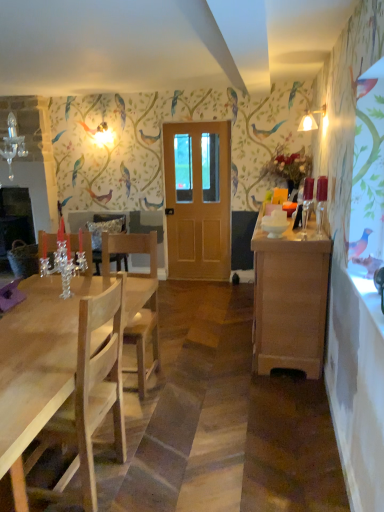
Locate an element on the screen. light brown wooden door at center is located at coordinates (198, 199).

Image resolution: width=384 pixels, height=512 pixels. Describe the element at coordinates (290, 300) in the screenshot. I see `wooden cabinet at right` at that location.

Where is `wooden cabinet at right`? The height and width of the screenshot is (512, 384). wooden cabinet at right is located at coordinates (290, 300).

The height and width of the screenshot is (512, 384). Identify the location of light wood chair at left, the first chair when ordered from front to back. (91, 384).

From the image's perspective, who appears lower, wooden cabinet at right or natural wood chair at left, acting as the 1th chair starting from the back?

natural wood chair at left, acting as the 1th chair starting from the back, is shown below in the image.

Measure the distance between wooden cabinet at right and natural wood chair at left, acting as the 1th chair starting from the back.

They are 95.47 centimeters apart.

Which is more to the right, wooden cabinet at right or natural wood chair at left, acting as the 1th chair starting from the back?

wooden cabinet at right.

Is the depth of matte white lampshade at upper right greater than that of natural wood chair at left, acting as the 1th chair starting from the back?

Yes, matte white lampshade at upper right is further from the viewer.

From the image's perspective, is matte white lampshade at upper right above or below natural wood chair at left, placed as the 2th chair when sorted from front to back?

Clearly, from the image's perspective, matte white lampshade at upper right is above natural wood chair at left, placed as the 2th chair when sorted from front to back.

How far apart are matte white lampshade at upper right and natural wood chair at left, acting as the 1th chair starting from the back?

matte white lampshade at upper right and natural wood chair at left, acting as the 1th chair starting from the back, are 7.71 feet apart from each other.

Is matte white lampshade at upper right with natural wood chair at left, placed as the 2th chair when sorted from front to back?

matte white lampshade at upper right and natural wood chair at left, placed as the 2th chair when sorted from front to back, are clearly separated.

Can you confirm if wooden cabinet at right is smaller than light brown wooden door at center?

Actually, wooden cabinet at right might be larger than light brown wooden door at center.

Considering the positions of objects wooden cabinet at right and light brown wooden door at center in the image provided, who is behind, wooden cabinet at right or light brown wooden door at center?

light brown wooden door at center.

Is wooden cabinet at right oriented away from light brown wooden door at center?

No.

Which is more to the left, wooden cabinet at right or matte white lampshade at upper right?

From the viewer's perspective, wooden cabinet at right appears more on the left side.

Based on their sizes in the image, would you say wooden cabinet at right is bigger or smaller than matte white lampshade at upper right?

Clearly, wooden cabinet at right is larger in size than matte white lampshade at upper right.

Is point (267, 259) positioned after point (304, 127)?

No, (267, 259) is in front of (304, 127).

Can you confirm if natural wood chair at left, acting as the 1th chair starting from the back, is bigger than light wood chair at left, the 2th chair when ordered from back to front?

Indeed, natural wood chair at left, acting as the 1th chair starting from the back, has a larger size compared to light wood chair at left, the 2th chair when ordered from back to front.

Is natural wood chair at left, acting as the 1th chair starting from the back, looking in the opposite direction of light wood chair at left, the 2th chair when ordered from back to front?

No, natural wood chair at left, acting as the 1th chair starting from the back, is not facing the opposite direction of light wood chair at left, the 2th chair when ordered from back to front.

From a real-world perspective, is natural wood chair at left, acting as the 1th chair starting from the back, positioned under light wood chair at left, the 2th chair when ordered from back to front, based on gravity?

Incorrect, from a real-world perspective, natural wood chair at left, acting as the 1th chair starting from the back, is higher than light wood chair at left, the 2th chair when ordered from back to front.

Is point (133, 240) closer or farther from the camera than point (92, 469)?

Point (133, 240).

Based on the photo, from a real-world perspective, who is located higher, light brown wooden door at center or light wood chair at left, the first chair when ordered from front to back?

Answer: In real-world perspective, light brown wooden door at center is above.

Is light brown wooden door at center not near light wood chair at left, the 2th chair when ordered from back to front?

Indeed, light brown wooden door at center is not near light wood chair at left, the 2th chair when ordered from back to front.

Starting from the light brown wooden door at center, which chair is the 2nd one to the left? Please provide its 2D coordinates.

[(91, 384)]

Can we say light brown wooden door at center lies outside light wood chair at left, the 2th chair when ordered from back to front?

light brown wooden door at center lies outside light wood chair at left, the 2th chair when ordered from back to front,'s area.

Does point (218, 209) come behind point (305, 123)?

Yes, point (218, 209) is farther from viewer.

The width and height of the screenshot is (384, 512). I want to click on lamp located in front of the light brown wooden door at center, so click(x=310, y=120).

How distant is light brown wooden door at center from matte white lampshade at upper right?

light brown wooden door at center is 4.95 feet from matte white lampshade at upper right.

Where is `chair that is the 1st one when counting forward from the wooden cabinet at right`? chair that is the 1st one when counting forward from the wooden cabinet at right is located at coordinates point(143,343).

Locate an element on the screen. lamp above the natural wood chair at left, acting as the 1th chair starting from the back (from the image's perspective) is located at coordinates (310, 120).

Looking at the image, which one is located further to wooden cabinet at right, light wood chair at left, the 2th chair when ordered from back to front, or natural wood chair at left, placed as the 2th chair when sorted from front to back?

The object further to wooden cabinet at right is light wood chair at left, the 2th chair when ordered from back to front.

Looking at the image, which one is located further to wooden cabinet at right, light brown wooden door at center or light wood chair at left, the first chair when ordered from front to back?

Among the two, light brown wooden door at center is located further to wooden cabinet at right.

Considering their positions, is light brown wooden door at center positioned further to light wood chair at left, the 2th chair when ordered from back to front, than wooden cabinet at right?

light brown wooden door at center.

Estimate the real-world distances between objects in this image. Which object is closer to wooden cabinet at right, light wood chair at left, the 2th chair when ordered from back to front, or light brown wooden door at center?

light wood chair at left, the 2th chair when ordered from back to front, is closer to wooden cabinet at right.

Estimate the real-world distances between objects in this image. Which object is closer to light brown wooden door at center, natural wood chair at left, placed as the 2th chair when sorted from front to back, or matte white lampshade at upper right?

Result: The object closer to light brown wooden door at center is matte white lampshade at upper right.

When comparing their distances from matte white lampshade at upper right, does light brown wooden door at center or wooden cabinet at right seem further?

wooden cabinet at right.

Considering their positions, is natural wood chair at left, placed as the 2th chair when sorted from front to back, positioned further to light wood chair at left, the first chair when ordered from front to back, than matte white lampshade at upper right?

matte white lampshade at upper right is positioned further to the anchor light wood chair at left, the first chair when ordered from front to back.

Looking at the image, which one is located further to natural wood chair at left, placed as the 2th chair when sorted from front to back, wooden cabinet at right or light brown wooden door at center?

light brown wooden door at center is further to natural wood chair at left, placed as the 2th chair when sorted from front to back.

What are the coordinates of `chair between light wood chair at left, the first chair when ordered from front to back, and wooden cabinet at right` in the screenshot? It's located at (143, 343).

Where is `cabinetry between natural wood chair at left, placed as the 2th chair when sorted from front to back, and matte white lampshade at upper right, in the horizontal direction`? The width and height of the screenshot is (384, 512). cabinetry between natural wood chair at left, placed as the 2th chair when sorted from front to back, and matte white lampshade at upper right, in the horizontal direction is located at coordinates (290, 300).

Image resolution: width=384 pixels, height=512 pixels. In order to click on cabinetry between natural wood chair at left, placed as the 2th chair when sorted from front to back, and light brown wooden door at center in the front-back direction in this screenshot , I will do `click(290, 300)`.

Locate an element on the screen. Image resolution: width=384 pixels, height=512 pixels. lamp located between natural wood chair at left, placed as the 2th chair when sorted from front to back, and light brown wooden door at center in the depth direction is located at coordinates 310,120.